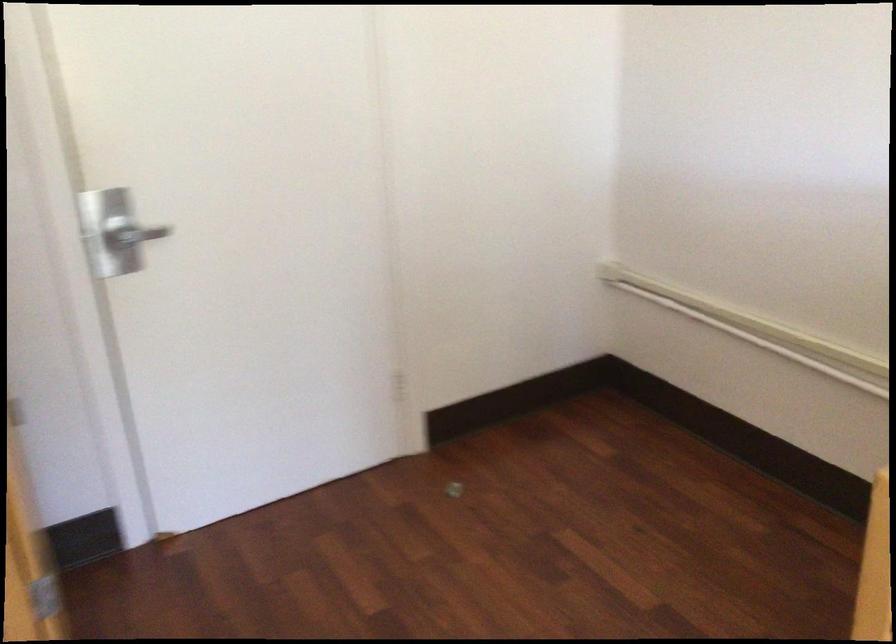
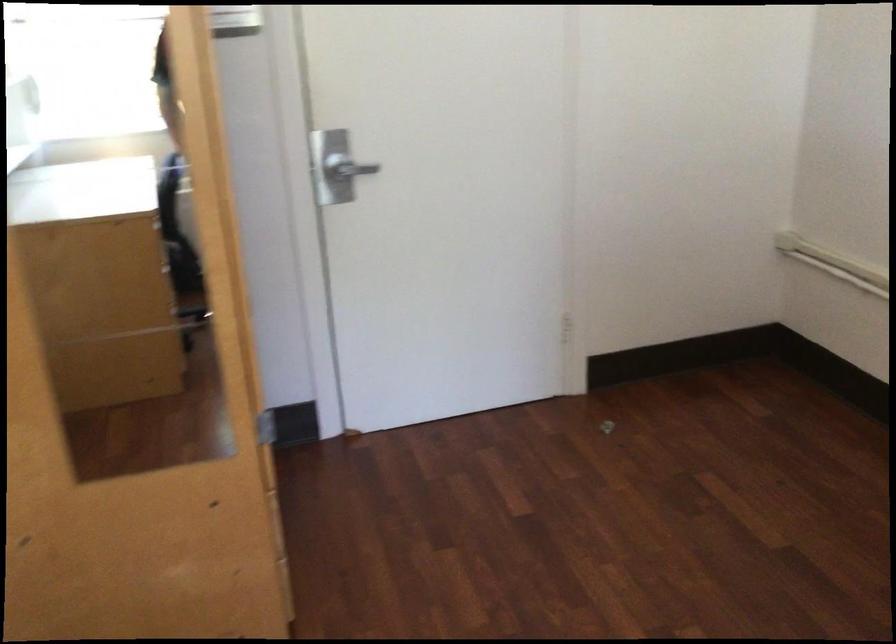
The images are taken continuously from a first-person perspective. In which direction are you moving?

The cameraman walked toward right, backward.